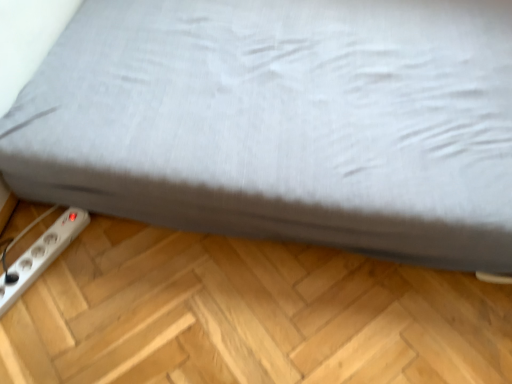
Question: Considering the relative sizes of white plastic power plugs and sockets at lower left and gray fabric bed at lower left in the image provided, is white plastic power plugs and sockets at lower left smaller than gray fabric bed at lower left?

Choices:
 (A) no
 (B) yes

Answer: (B)

Question: Considering the relative sizes of white plastic power plugs and sockets at lower left and gray fabric bed at lower left in the image provided, is white plastic power plugs and sockets at lower left taller than gray fabric bed at lower left?

Choices:
 (A) yes
 (B) no

Answer: (B)

Question: Is white plastic power plugs and sockets at lower left wider than gray fabric bed at lower left?

Choices:
 (A) yes
 (B) no

Answer: (B)

Question: Could you tell me if white plastic power plugs and sockets at lower left is facing gray fabric bed at lower left?

Choices:
 (A) yes
 (B) no

Answer: (B)

Question: Is white plastic power plugs and sockets at lower left at the left side of gray fabric bed at lower left?

Choices:
 (A) yes
 (B) no

Answer: (A)

Question: Is white plastic power plugs and sockets at lower left behind gray fabric bed at lower left?

Choices:
 (A) yes
 (B) no

Answer: (A)

Question: Is gray fabric bed at lower left not inside white plastic power plugs and sockets at lower left?

Choices:
 (A) yes
 (B) no

Answer: (A)

Question: Is gray fabric bed at lower left looking in the opposite direction of white plastic power plugs and sockets at lower left?

Choices:
 (A) yes
 (B) no

Answer: (B)

Question: Is gray fabric bed at lower left behind white plastic power plugs and sockets at lower left?

Choices:
 (A) no
 (B) yes

Answer: (A)

Question: From the image's perspective, is gray fabric bed at lower left over white plastic power plugs and sockets at lower left?

Choices:
 (A) yes
 (B) no

Answer: (A)

Question: Does gray fabric bed at lower left have a smaller size compared to white plastic power plugs and sockets at lower left?

Choices:
 (A) yes
 (B) no

Answer: (B)

Question: Does gray fabric bed at lower left come in front of white plastic power plugs and sockets at lower left?

Choices:
 (A) yes
 (B) no

Answer: (A)

Question: From a real-world perspective, relative to gray fabric bed at lower left, is white plastic power plugs and sockets at lower left vertically above or below?

Choices:
 (A) above
 (B) below

Answer: (B)